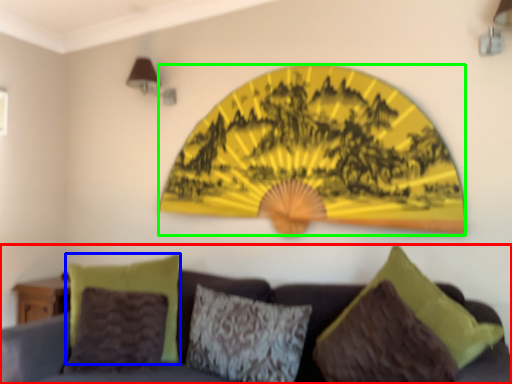
Question: Which object is positioned farthest from studio couch (highlighted by a red box)? Select from pillow (highlighted by a blue box) and design (highlighted by a green box).

Choices:
 (A) pillow
 (B) design

Answer: (B)